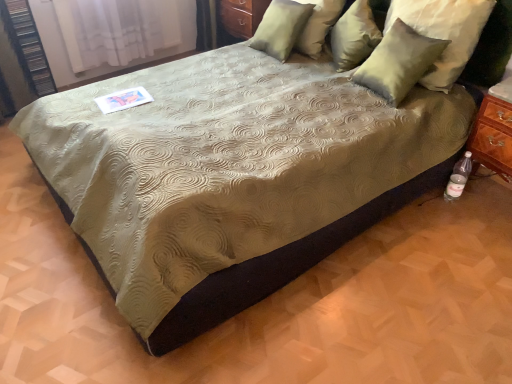
In order to click on vacant region in front of clear plastic bottle at lower right in this screenshot , I will do `click(459, 221)`.